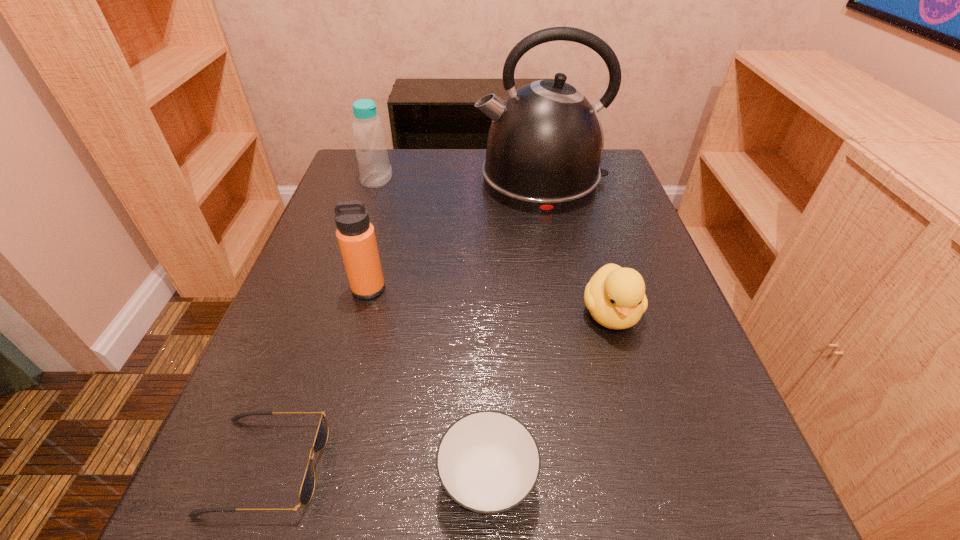
Identify the location of sunglasses at the left edge. (307, 487).

Identify the location of kettle that is at the right edge. The image size is (960, 540). (545, 143).

Locate an element on the screen. This screenshot has height=540, width=960. duck that is at the right edge is located at coordinates [x=615, y=297].

Locate an element on the screen. object that is at the far left corner is located at coordinates (370, 144).

Identify the location of object at the near left corner. (307, 487).

In order to click on object located in the far right corner section of the desktop in this screenshot , I will do `click(545, 143)`.

Find the location of a particular element. free space at the far edge of the desktop is located at coordinates (483, 193).

Where is `vacant space at the near edge of the desktop`? Image resolution: width=960 pixels, height=540 pixels. vacant space at the near edge of the desktop is located at coordinates (534, 535).

I want to click on free space at the left edge, so click(x=340, y=370).

Image resolution: width=960 pixels, height=540 pixels. I want to click on vacant space at the right edge, so click(599, 218).